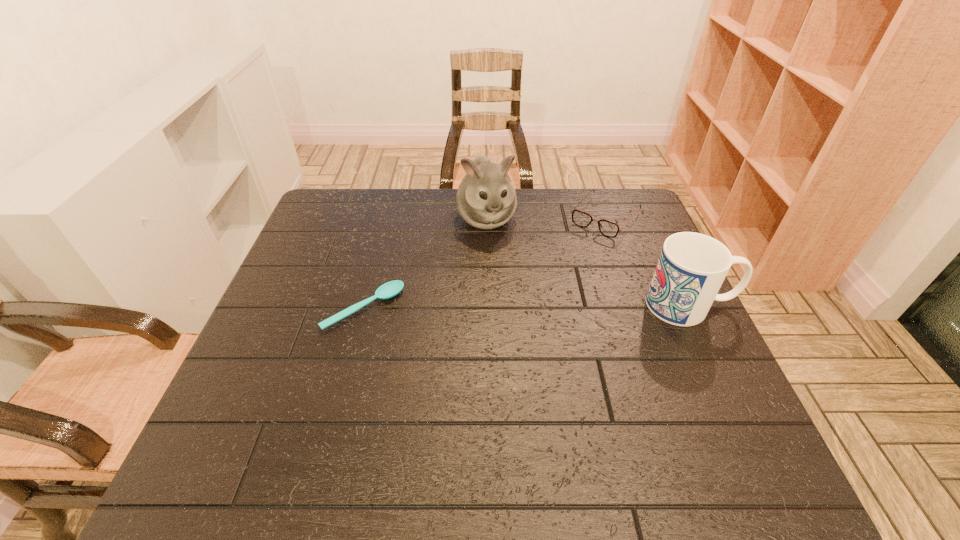
Locate an element on the screen. the leftmost object is located at coordinates (390, 289).

Image resolution: width=960 pixels, height=540 pixels. I want to click on spoon, so click(390, 289).

Identify the location of mug. (691, 268).

Where is `the third tallest object`? Image resolution: width=960 pixels, height=540 pixels. the third tallest object is located at coordinates (607, 228).

The height and width of the screenshot is (540, 960). In order to click on the second object from left to right in this screenshot , I will do `click(486, 199)`.

Identify the location of hamster. (486, 199).

The width and height of the screenshot is (960, 540). I want to click on vacant space located on the front of the spoon, so click(349, 366).

At what (x,y) coordinates should I click in order to perform the action: click on blank space located 0.120m on the back of the mug. Please return your answer as a coordinate pair (x, y). The image size is (960, 540). Looking at the image, I should click on (666, 255).

The image size is (960, 540). Identify the location of vacant region located 0.330m on the front-facing side of the sunglasses. (534, 303).

Image resolution: width=960 pixels, height=540 pixels. I want to click on vacant space located 0.050m on the front-facing side of the sunglasses, so click(x=583, y=245).